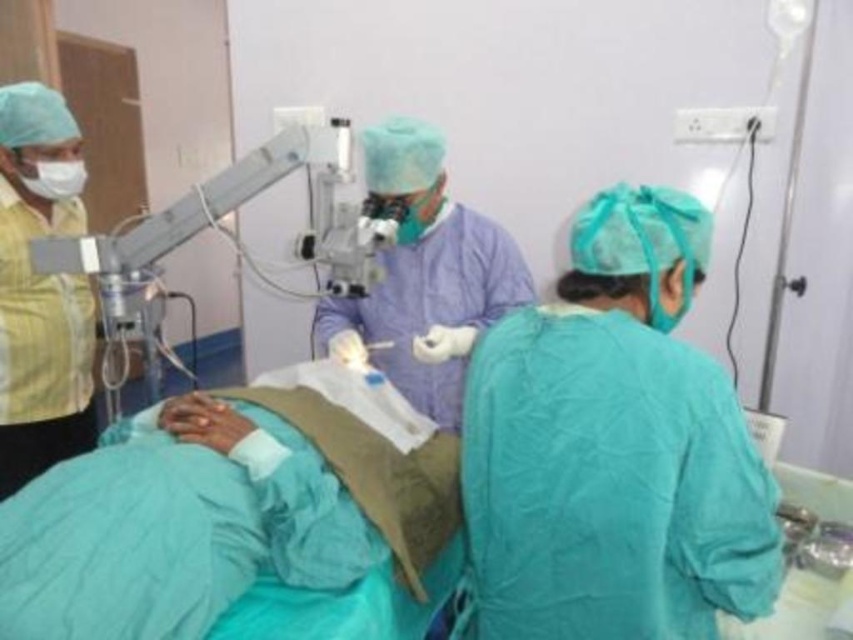
Who is positioned more to the left, green surgical gown at center or metallic microscope at upper center?

Positioned to the left is metallic microscope at upper center.

How much distance is there between green surgical gown at center and metallic microscope at upper center?

green surgical gown at center is 21.75 inches from metallic microscope at upper center.

Identify the location of green surgical gown at center. The width and height of the screenshot is (853, 640). (613, 448).

Does point (421, 205) come behind point (109, 360)?

No, (421, 205) is closer to viewer.

Does purple smooth surgical gown at center have a smaller size compared to metallic microscope at upper center?

Correct, purple smooth surgical gown at center occupies less space than metallic microscope at upper center.

Locate an element on the screen. purple smooth surgical gown at center is located at coordinates (426, 275).

Does metallic microscope at upper center appear under white matte mask at upper left?

Indeed, metallic microscope at upper center is positioned under white matte mask at upper left.

Who is more distant from viewer, (212, 204) or (70, 188)?

Positioned behind is point (70, 188).

At what (x,y) coordinates should I click in order to perform the action: click on metallic microscope at upper center. Please return your answer as a coordinate pair (x, y). This screenshot has width=853, height=640. Looking at the image, I should click on (225, 234).